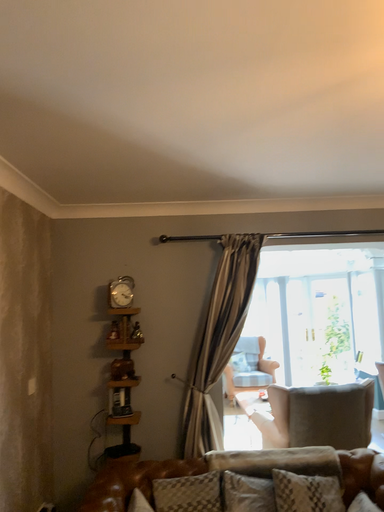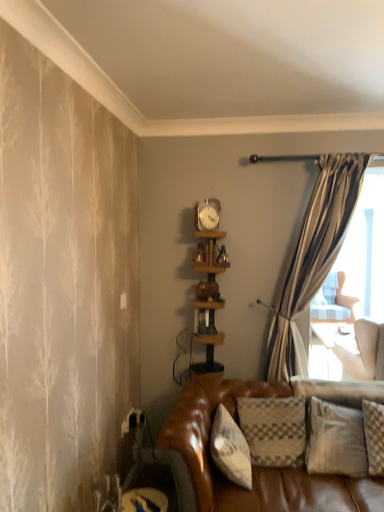
Question: How did the camera likely rotate when shooting the video?

Choices:
 (A) rotated right
 (B) rotated left

Answer: (B)